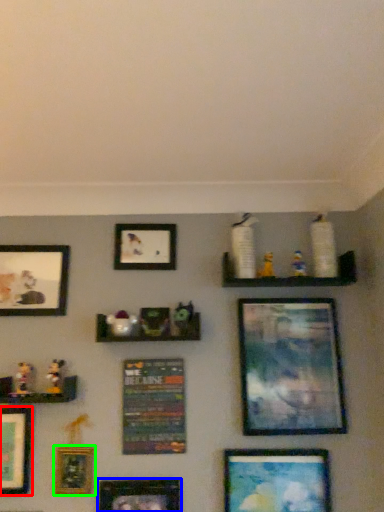
Question: Estimate the real-world distances between objects in this image. Which object is closer to picture frame (highlighted by a red box), picture frame (highlighted by a blue box) or picture frame (highlighted by a green box)?

Choices:
 (A) picture frame
 (B) picture frame

Answer: (B)